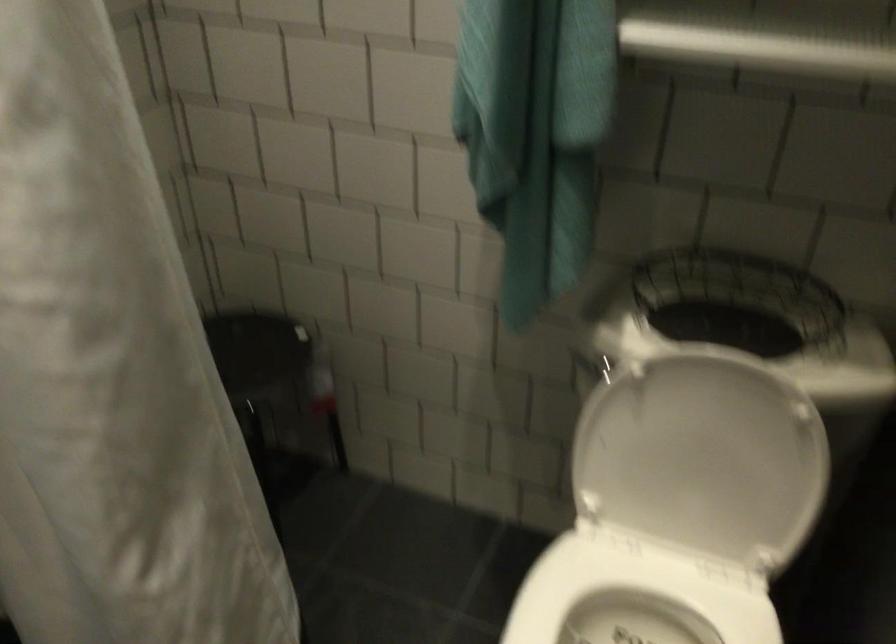
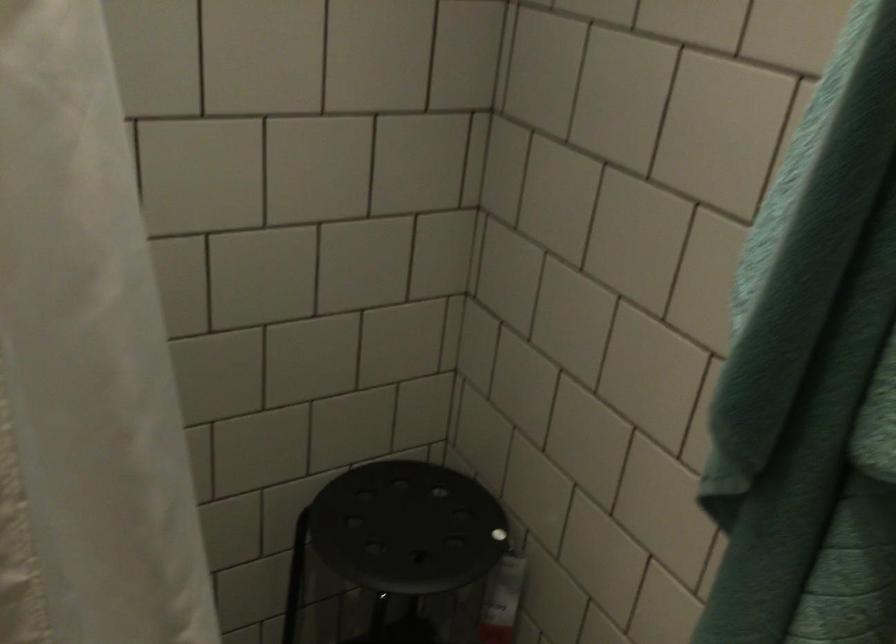
Question: The camera is either moving clockwise (left) or counter-clockwise (right) around the object. The first image is from the beginning of the video and the second image is from the end. Is the camera moving left or right when shooting the video?

Choices:
 (A) Left
 (B) Right

Answer: (B)